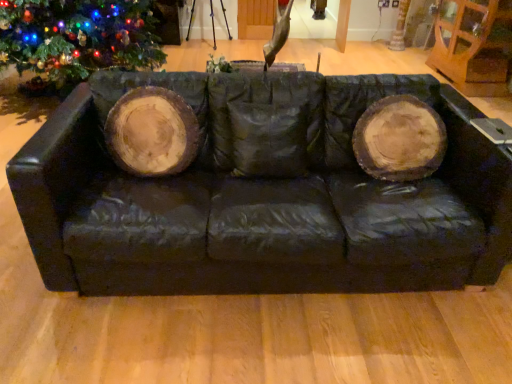
Question: In terms of height, does black leather couch at center look taller or shorter compared to brown wood tree trunk at upper right?

Choices:
 (A) tall
 (B) short

Answer: (A)

Question: From a real-world perspective, is black leather couch at center physically located above or below brown wood tree trunk at upper right?

Choices:
 (A) above
 (B) below

Answer: (A)

Question: Estimate the real-world distances between objects in this image. Which object is closer to the green matte christmas tree at left?

Choices:
 (A) black leather couch at center
 (B) brown wood tree trunk at upper right

Answer: (A)

Question: Considering the real-world distances, which object is farthest from the black leather couch at center?

Choices:
 (A) brown wood tree trunk at upper right
 (B) green matte christmas tree at left

Answer: (A)